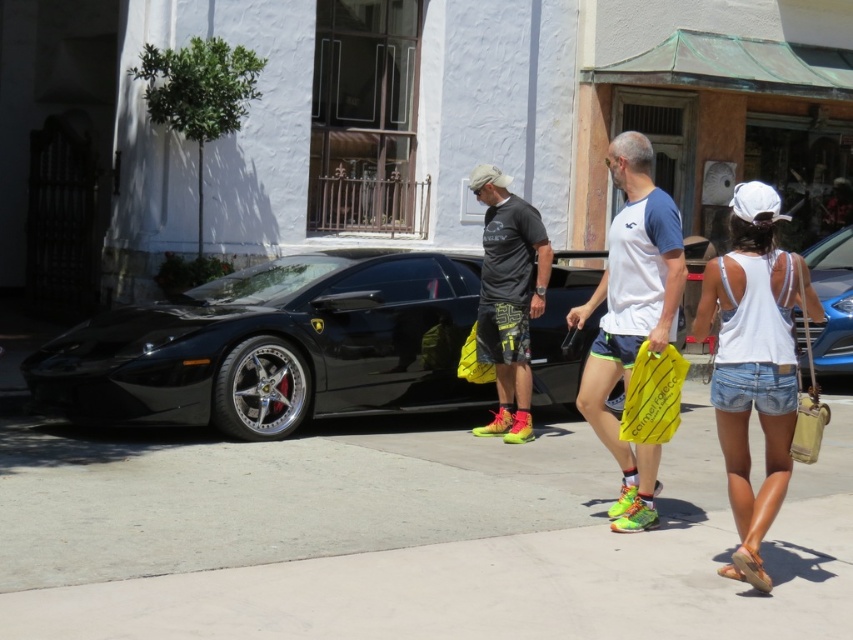
Question: Which of the following is the closest to the observer?

Choices:
 (A) (840, 266)
 (B) (503, 291)

Answer: (B)

Question: Is shiny blue car at center above yellow plastic bag at center?

Choices:
 (A) no
 (B) yes

Answer: (B)

Question: Estimate the real-world distances between objects in this image. Which object is farther from the yellow plastic bag at center?

Choices:
 (A) matte black t-shirt at center
 (B) gray concrete pavement at center
 (C) white cotton tank top at center

Answer: (A)

Question: Where is white cotton tank top at center located in relation to white fabric shirt at center in the image?

Choices:
 (A) left
 (B) right

Answer: (B)

Question: Can you confirm if matte black t-shirt at center is bigger than yellow plastic bag at center?

Choices:
 (A) yes
 (B) no

Answer: (A)

Question: Which object is the closest to the yellow plastic bag at center?

Choices:
 (A) shiny black sports car at center-left
 (B) white cotton tank top at center
 (C) matte black t-shirt at center
 (D) white fabric shirt at center

Answer: (D)